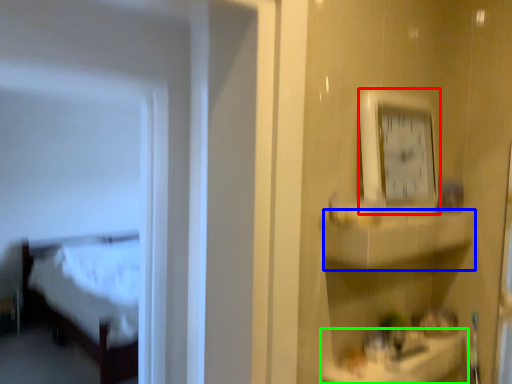
Question: Based on their relative distances, which object is nearer to clock (highlighted by a red box)? Choose from cabinet (highlighted by a blue box) and counter top (highlighted by a green box).

Choices:
 (A) cabinet
 (B) counter top

Answer: (A)